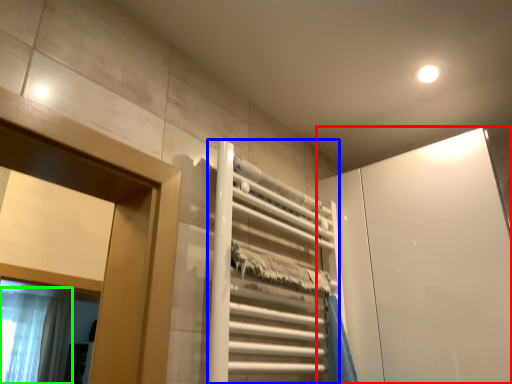
Question: Which object is the farthest from screen door (highlighted by a red box)? Choose among these: elevator (highlighted by a blue box) or shower curtain (highlighted by a green box).

Choices:
 (A) elevator
 (B) shower curtain

Answer: (B)